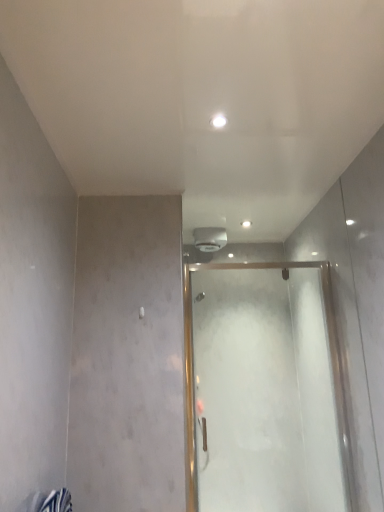
Question: Considering the relative sizes of frosted glass door at center and white glossy light at center in the image provided, is frosted glass door at center thinner than white glossy light at center?

Choices:
 (A) no
 (B) yes

Answer: (B)

Question: Considering the relative positions of frosted glass door at center and white glossy light at center in the image provided, is frosted glass door at center to the right of white glossy light at center from the viewer's perspective?

Choices:
 (A) yes
 (B) no

Answer: (A)

Question: Could you tell me if frosted glass door at center is facing white glossy light at center?

Choices:
 (A) no
 (B) yes

Answer: (A)

Question: Is frosted glass door at center at the left side of white glossy light at center?

Choices:
 (A) yes
 (B) no

Answer: (B)

Question: Can you confirm if frosted glass door at center is smaller than white glossy light at center?

Choices:
 (A) yes
 (B) no

Answer: (B)

Question: Is white glossy light at center located within frosted glass door at center?

Choices:
 (A) no
 (B) yes

Answer: (A)

Question: Is frosted glass door at center inside white glossy light at center?

Choices:
 (A) yes
 (B) no

Answer: (B)

Question: Is white glossy light at center not within frosted glass door at center?

Choices:
 (A) yes
 (B) no

Answer: (A)

Question: Considering the relative sizes of white glossy light at center and frosted glass door at center in the image provided, is white glossy light at center thinner than frosted glass door at center?

Choices:
 (A) no
 (B) yes

Answer: (A)

Question: Can you confirm if white glossy light at center is positioned to the right of frosted glass door at center?

Choices:
 (A) no
 (B) yes

Answer: (A)

Question: Is white glossy light at center next to frosted glass door at center and touching it?

Choices:
 (A) yes
 (B) no

Answer: (B)

Question: Is white glossy light at center behind frosted glass door at center?

Choices:
 (A) no
 (B) yes

Answer: (A)

Question: Considering the positions of white glossy light at center and frosted glass door at center in the image, is white glossy light at center taller or shorter than frosted glass door at center?

Choices:
 (A) tall
 (B) short

Answer: (B)